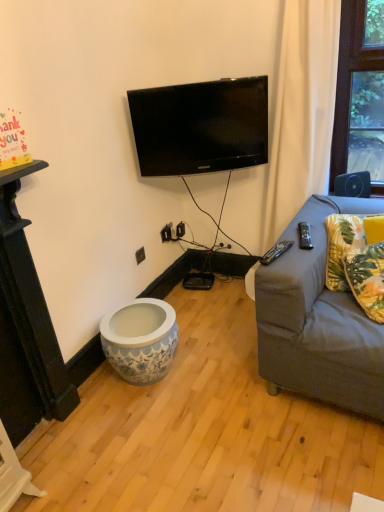
Question: Does yellow floral fabric pillow at right, acting as the second pillow starting from the back, have a larger size compared to black plastic outlet at lower center?

Choices:
 (A) no
 (B) yes

Answer: (B)

Question: From the image's perspective, is yellow floral fabric pillow at right, arranged as the first pillow when viewed from the front, over black plastic outlet at lower center?

Choices:
 (A) yes
 (B) no

Answer: (B)

Question: Would you consider yellow floral fabric pillow at right, acting as the second pillow starting from the back, to be distant from black plastic outlet at lower center?

Choices:
 (A) yes
 (B) no

Answer: (A)

Question: Can you confirm if yellow floral fabric pillow at right, acting as the second pillow starting from the back, is positioned to the right of black plastic outlet at lower center?

Choices:
 (A) no
 (B) yes

Answer: (B)

Question: Can you confirm if yellow floral fabric pillow at right, acting as the second pillow starting from the back, is positioned to the left of black plastic outlet at lower center?

Choices:
 (A) no
 (B) yes

Answer: (A)

Question: Is black glossy tv at upper center inside the boundaries of yellow floral fabric pillow at right, acting as the second pillow starting from the back, or outside?

Choices:
 (A) outside
 (B) inside

Answer: (A)

Question: From their relative heights in the image, would you say black glossy tv at upper center is taller or shorter than yellow floral fabric pillow at right, acting as the second pillow starting from the back?

Choices:
 (A) short
 (B) tall

Answer: (B)

Question: From the image's perspective, relative to yellow floral fabric pillow at right, arranged as the first pillow when viewed from the front, is black glossy tv at upper center above or below?

Choices:
 (A) below
 (B) above

Answer: (B)

Question: Is black glossy tv at upper center wider or thinner than yellow floral fabric pillow at right, arranged as the first pillow when viewed from the front?

Choices:
 (A) wide
 (B) thin

Answer: (B)

Question: Is black plastic remote control at right, which is the second remote control from right to left, in front of or behind yellow floral fabric pillow at right, acting as the second pillow starting from the back, in the image?

Choices:
 (A) behind
 (B) front

Answer: (A)

Question: In terms of size, does black plastic remote control at right, which is the first remote control from left to right, appear bigger or smaller than yellow floral fabric pillow at right, arranged as the first pillow when viewed from the front?

Choices:
 (A) small
 (B) big

Answer: (A)

Question: From a real-world perspective, relative to yellow floral fabric pillow at right, acting as the second pillow starting from the back, is black plastic remote control at right, which is the first remote control from left to right, vertically above or below?

Choices:
 (A) above
 (B) below

Answer: (A)

Question: Do you think black plastic remote control at right, which is the first remote control from left to right, is within yellow floral fabric pillow at right, acting as the second pillow starting from the back, or outside of it?

Choices:
 (A) outside
 (B) inside

Answer: (A)

Question: Would you say yellow fabric pillow at right, the 1th pillow from the back, is to the left or to the right of black glossy tv at upper center in the picture?

Choices:
 (A) right
 (B) left

Answer: (A)

Question: Considering the positions of yellow fabric pillow at right, the second pillow viewed from the front, and black glossy tv at upper center in the image, is yellow fabric pillow at right, the second pillow viewed from the front, wider or thinner than black glossy tv at upper center?

Choices:
 (A) wide
 (B) thin

Answer: (A)